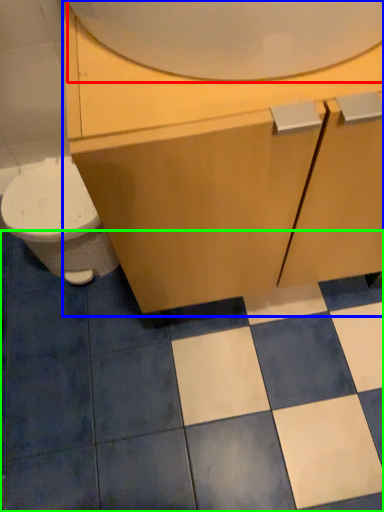
Question: Which object is positioned farthest from mirror (highlighted by a red box)? Select from bathroom cabinet (highlighted by a blue box) and ceramic tile (highlighted by a green box).

Choices:
 (A) bathroom cabinet
 (B) ceramic tile

Answer: (B)